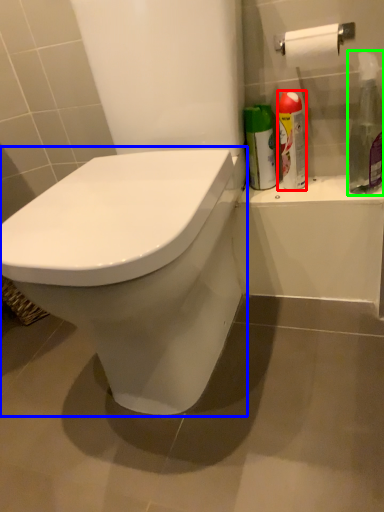
Question: Based on their relative distances, which object is farther from cleaning product (highlighted by a red box)? Choose from toilet (highlighted by a blue box) and cleaning product (highlighted by a green box).

Choices:
 (A) toilet
 (B) cleaning product

Answer: (A)